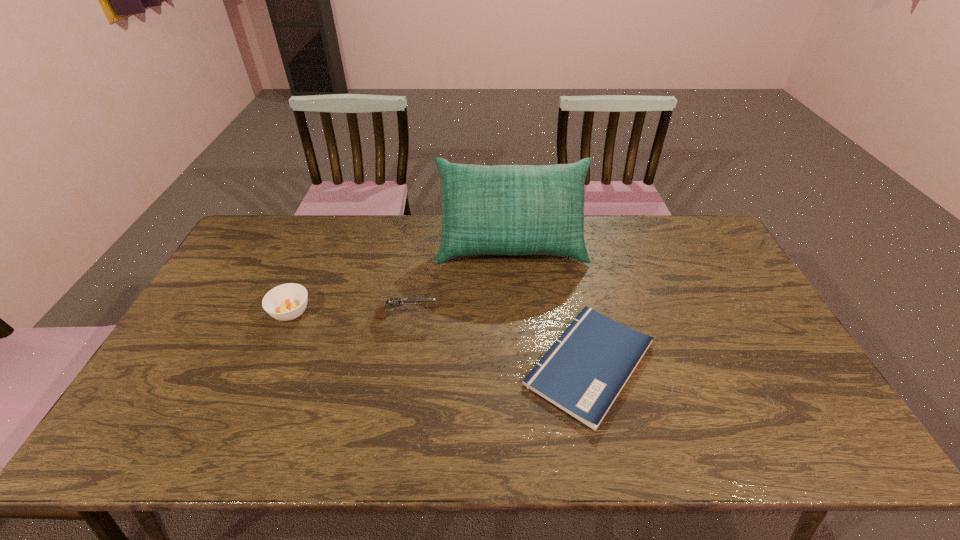
Locate an element on the screen. Image resolution: width=960 pixels, height=540 pixels. vacant region that satisfies the following two spatial constraints: 1. on the front-facing side of the shortest object; 2. on the right side of the cushion is located at coordinates (520, 364).

Find the location of a particular element. The height and width of the screenshot is (540, 960). vacant point that satisfies the following two spatial constraints: 1. on the front-facing side of the paperback book; 2. on the right side of the cushion is located at coordinates (520, 364).

Find the location of `vacant area in the image that satisfies the following two spatial constraints: 1. aiming along the barrel of the gun; 2. on the back side of the paperback book`. vacant area in the image that satisfies the following two spatial constraints: 1. aiming along the barrel of the gun; 2. on the back side of the paperback book is located at coordinates (398, 364).